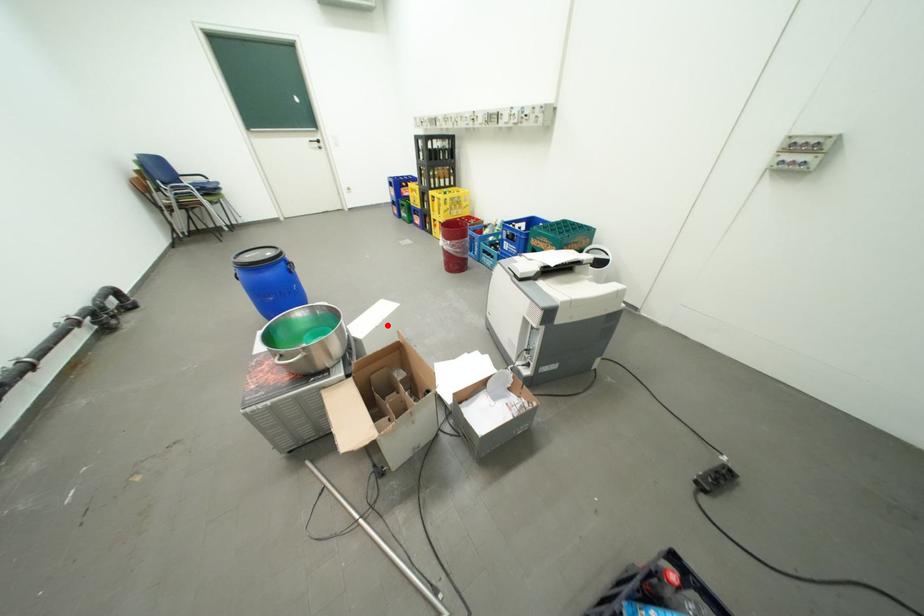
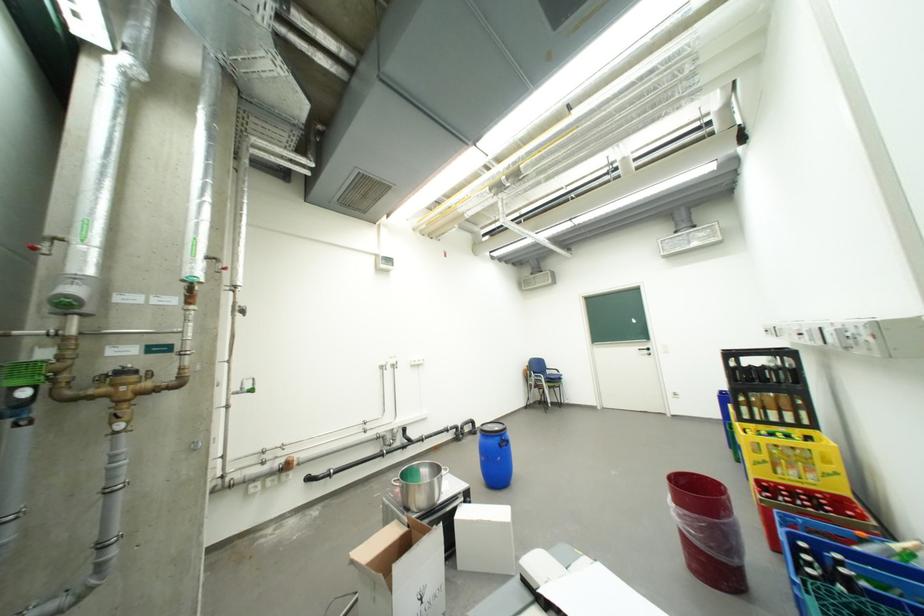
Locate, in the second image, the point that corresponds to the highlighted location in the first image.

(484, 520)